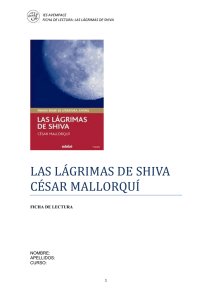
You are a GUI agent. You are given a task and a screenshot of the screen. Output one action in this format:
    pyautogui.click(x=<x>, y=<y>)
    Task: Click on the book
    
    Given the screenshot: What is the action you would take?
    pyautogui.click(x=84, y=133)